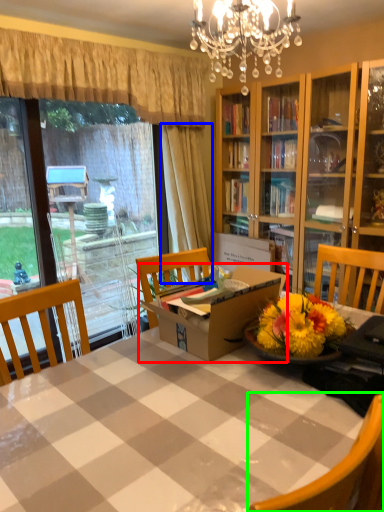
Question: Which object is the farthest from box (highlighted by a red box)? Choose among these: curtain (highlighted by a blue box) or chair (highlighted by a green box).

Choices:
 (A) curtain
 (B) chair

Answer: (A)